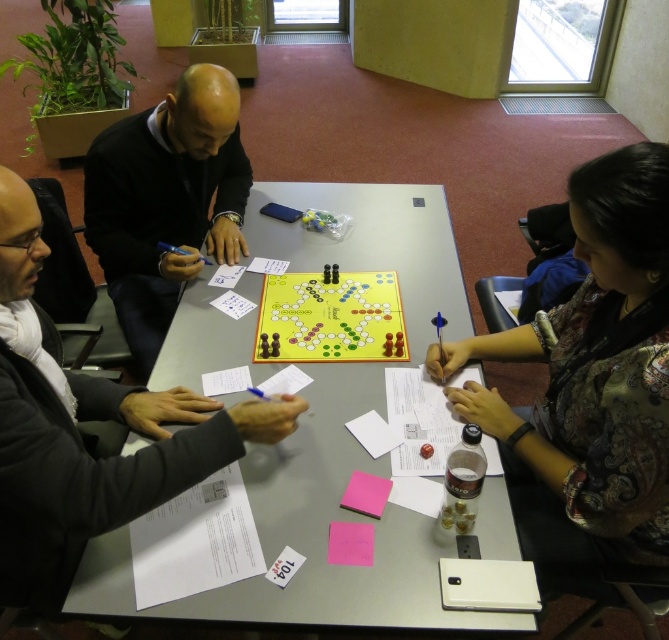
Question: Which point is farther to the camera?

Choices:
 (A) (118, 493)
 (B) (626, 556)
 (C) (258, 353)
 (D) (225, 163)

Answer: (D)

Question: Can you confirm if dark gray sweater at left is smaller than yellow matte board game at center?

Choices:
 (A) no
 (B) yes

Answer: (A)

Question: Which of the following is the closest to the observer?

Choices:
 (A) (262, 310)
 (B) (304, 433)
 (C) (522, 436)

Answer: (C)

Question: Which point appears closest to the camera in this image?

Choices:
 (A) (191, 332)
 (B) (573, 202)
 (C) (124, 504)

Answer: (C)

Question: Does smooth plastic table at center appear on the right side of yellow matte board game at center?

Choices:
 (A) no
 (B) yes

Answer: (B)

Question: Is smooth plastic table at center to the left of yellow matte board game at center from the viewer's perspective?

Choices:
 (A) no
 (B) yes

Answer: (A)